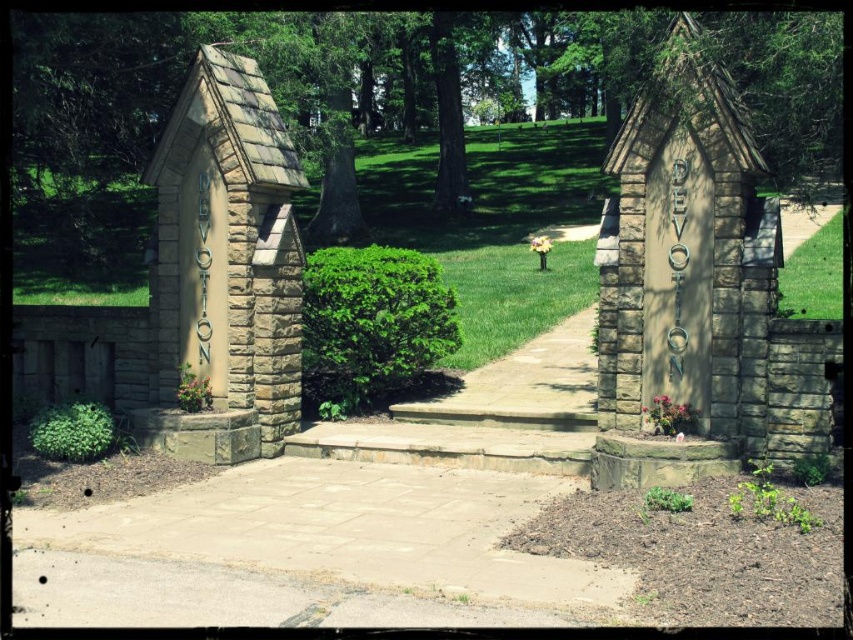
You are walking along the stone pathway and want to reach the green leafy bush at center. Which direction should you move relative to the stone textured hut at left?

The stone textured hut at left is positioned on the left side of the green leafy bush at center, so you should move to the right of the stone textured hut at left to reach the green leafy bush at center.

You are standing at the starting point of the stone pathway and want to reach the grassy area ahead. There are two points marked on the path. Which point should you aim for first if you want to reach the grassy area as quickly as possible? The points are point 1 at coordinates point (384, 371) and point 2 at coordinates point (79, 429).

You should aim for point 2 at coordinates point (79, 429) first because it is closer to you than point 1 at coordinates point (384, 371), which is further behind.

You are a gardener who needs to water both the green leafy bush at center and the green leafy hedge at lower left. If your watering can holds enough water for 7 feet of travel, can you water both without refilling?

The distance between the green leafy bush at center and the green leafy hedge at lower left is 8.01 feet, which exceeds the watering can capacity of 7 feet. Therefore, you cannot water both without refilling.